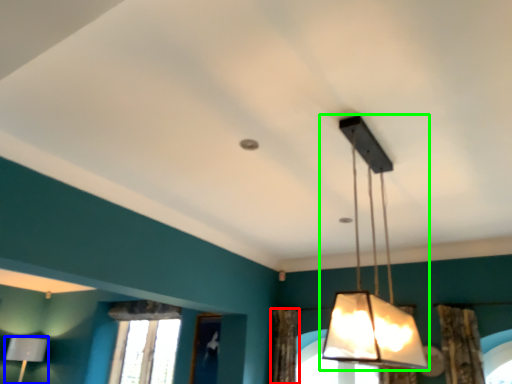
Question: Considering the real-world distances, which object is farthest from curtain (highlighted by a red box)? lamp (highlighted by a blue box) or lamp (highlighted by a green box)?

Choices:
 (A) lamp
 (B) lamp

Answer: (B)